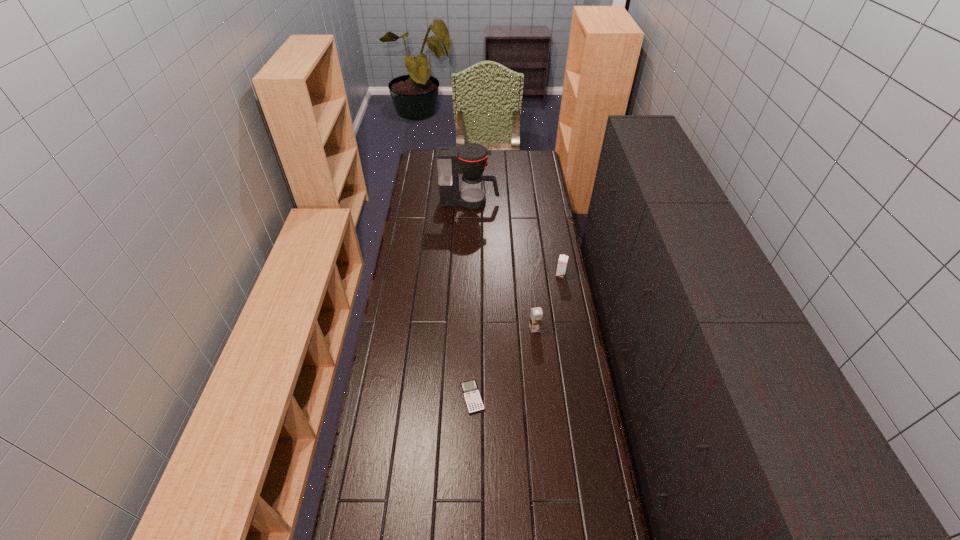
What are the coordinates of `coffee maker` in the screenshot? It's located at (470, 159).

Find the location of `the farthest object`. the farthest object is located at coordinates (470, 159).

Where is `the left chocolate milk`? the left chocolate milk is located at coordinates (536, 314).

Locate an element on the screen. This screenshot has height=540, width=960. the third farthest object is located at coordinates (536, 314).

You are a GUI agent. You are given a task and a screenshot of the screen. Output one action in this format:
    pyautogui.click(x=<x>, y=<y>)
    Task: Click on the right chocolate milk
    The height and width of the screenshot is (540, 960).
    Given the screenshot: What is the action you would take?
    pyautogui.click(x=563, y=259)

Where is `the second farthest object`? The height and width of the screenshot is (540, 960). the second farthest object is located at coordinates (563, 259).

The image size is (960, 540). Find the location of `calculator`. calculator is located at coordinates (473, 400).

Locate an element on the screen. the nearest object is located at coordinates (473, 400).

I want to click on vacant space located 0.190m pour from the carafe of the coffee maker, so click(x=535, y=202).

This screenshot has width=960, height=540. What are the coordinates of `vacant space situated on the back of the left chocolate milk` in the screenshot? It's located at (530, 282).